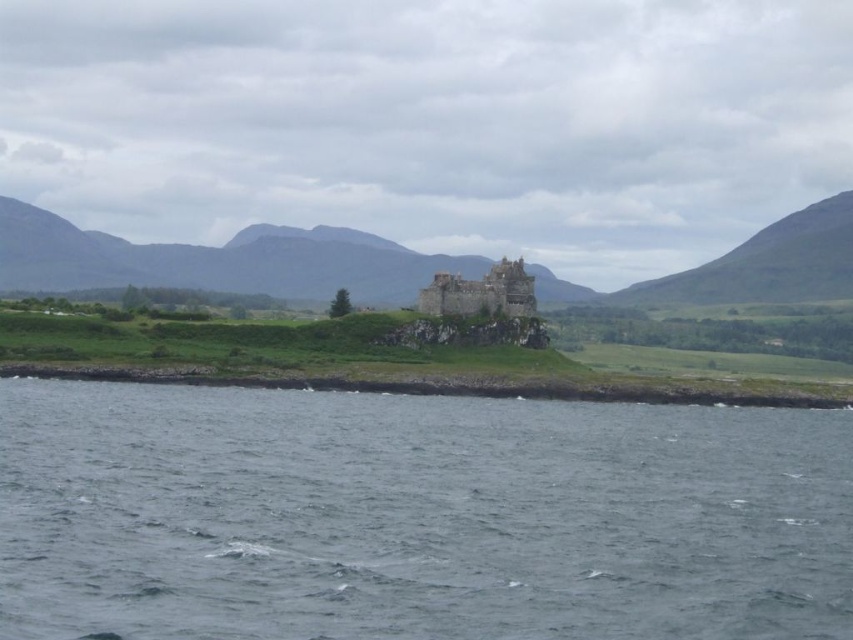
Consider the image. You are standing at the center of the castle and want to reach the green grassy hill at right. Which direction should you walk to get there?

You should walk to the right to reach the green grassy hill at right since it is located at point (767, 262), which is to the right side of the image.

You are standing in the landscape and want to walk from the green grassy hill at center to the rustic stone castle at center. Which direction should you move relative to your current position?

You should move away from yourself because the green grassy hill at center is closer to you than the rustic stone castle at center, so to reach the castle, you need to move forward past the hill.